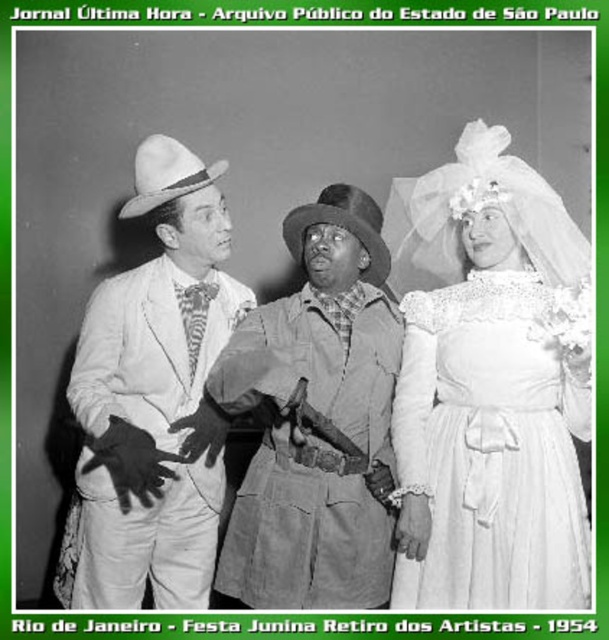
Question: Does matte white dress at center have a greater width compared to white matte suit at center?

Choices:
 (A) no
 (B) yes

Answer: (A)

Question: In this image, where is white matte suit at center located relative to leather jacket at center?

Choices:
 (A) left
 (B) right

Answer: (A)

Question: From the image, what is the correct spatial relationship of white matte suit at center in relation to white lace dress at right?

Choices:
 (A) right
 (B) left

Answer: (B)

Question: Which object appears closest to the camera in this image?

Choices:
 (A) white matte suit at center
 (B) leather jacket at center
 (C) white lace dress at right
 (D) matte white dress at center

Answer: (C)

Question: Which is nearer to the white matte suit at center?

Choices:
 (A) matte white dress at center
 (B) white lace dress at right

Answer: (A)

Question: Which point is farther to the camera?

Choices:
 (A) white matte suit at center
 (B) white lace dress at right

Answer: (A)